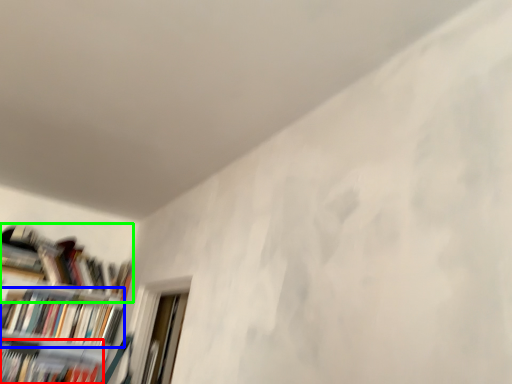
Question: Which object is the farthest from book (highlighted by a red box)? Choose among these: book (highlighted by a blue box) or book (highlighted by a green box).

Choices:
 (A) book
 (B) book

Answer: (B)